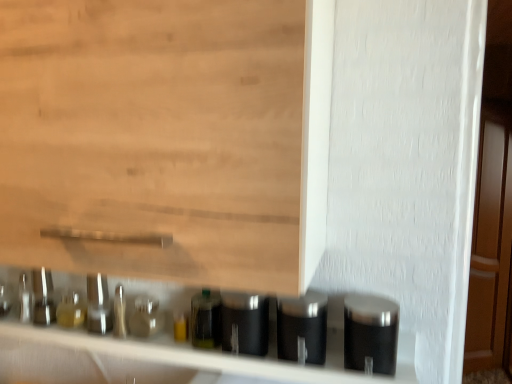
Question: Considering the positions of point (297, 314) and point (136, 316), is point (297, 314) closer or farther from the camera than point (136, 316)?

Choices:
 (A) farther
 (B) closer

Answer: (B)

Question: Is satin silver canister at lower center, which appears as the 2th silver when viewed from the left, wider or thinner than black matte canisters at lower center?

Choices:
 (A) wide
 (B) thin

Answer: (B)

Question: Estimate the real-world distances between objects in this image. Which object is farther from the satin silver canister at lower center, which is counted as the 2th silver, starting from the right?

Choices:
 (A) translucent glass bottle at center
 (B) wooden door at right
 (C) satin metallic canister at center, which is counted as the 1th silver, starting from the left
 (D) satin black container at right, which is the first silver in right-to-left order
 (E) black matte canisters at lower center

Answer: (B)

Question: Based on their relative distances, which object is nearer to the satin metallic canister at center, which is counted as the 1th silver, starting from the left?

Choices:
 (A) satin black container at right, arranged as the third silver when viewed from the left
 (B) wooden door at right
 (C) black matte canisters at lower center
 (D) translucent glass bottle at center
 (E) satin silver canister at lower center, which is counted as the 2th silver, starting from the right

Answer: (D)